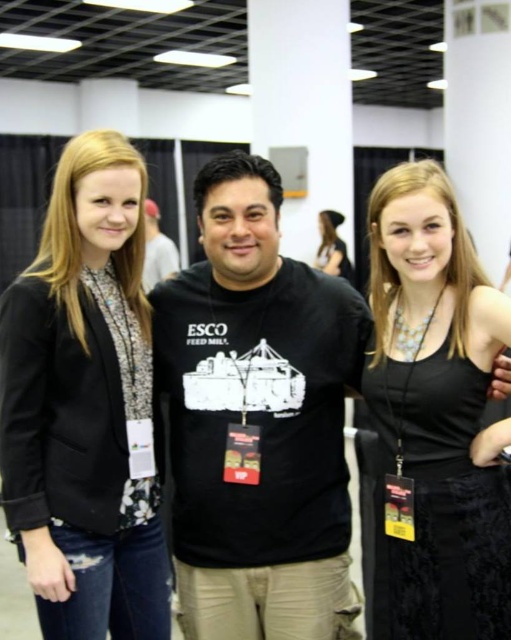
Is point (164, 340) positioned after point (144, 259)?

No, it is in front of (144, 259).

Identify the location of black matte t-shirt at center. click(x=254, y=417).

Consider the image. Between black velvet dress at center and black matte shirt at center, which one is positioned lower?

black velvet dress at center

Who is shorter, black velvet dress at center or black matte shirt at center?

With less height is black matte shirt at center.

Which is behind, point (459, 212) or point (150, 244)?

Positioned behind is point (150, 244).

The width and height of the screenshot is (511, 640). What are the coordinates of `black velvet dress at center` in the screenshot? It's located at (434, 417).

From the picture: Is black matte shirt at center taller than blonde hair at upper right?

Indeed, black matte shirt at center has a greater height compared to blonde hair at upper right.

Can you confirm if black matte shirt at center is positioned above blonde hair at upper right?

Indeed, black matte shirt at center is positioned over blonde hair at upper right.

Who is more distant from viewer, (151, 268) or (318, 252)?

The point (318, 252) is more distant.

This screenshot has width=511, height=640. In order to click on black matte shirt at center in this screenshot , I will do `click(156, 250)`.